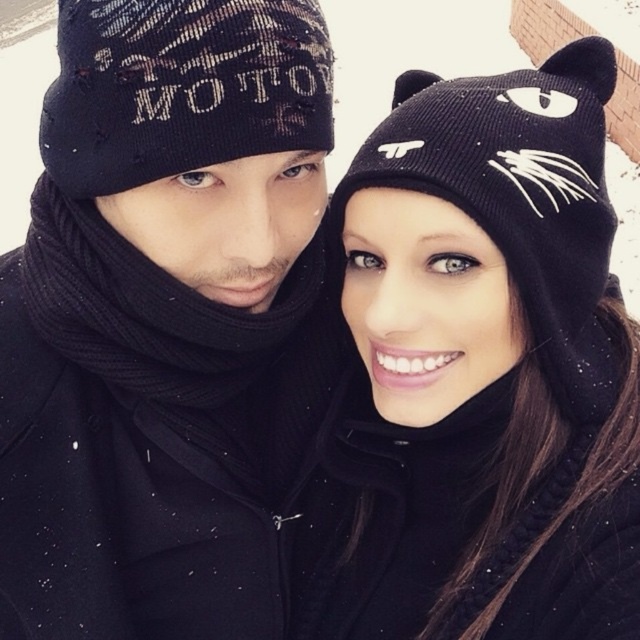
Does matte black beanie at center have a greater width compared to black knitted beanie at left?

Yes.

Does point (164, 138) come in front of point (312, 3)?

Yes, point (164, 138) is in front of point (312, 3).

In order to click on matte black beanie at center in this screenshot , I will do `click(164, 321)`.

Between black knit beanie with cat ears at upper right and black knitted beanie at left, which one is positioned higher?

black knitted beanie at left

Does black knit beanie with cat ears at upper right have a lesser height compared to black knitted beanie at left?

No, black knit beanie with cat ears at upper right is not shorter than black knitted beanie at left.

Is point (602, 444) closer to viewer compared to point (326, 58)?

That is True.

At what (x,y) coordinates should I click in order to perform the action: click on black knit beanie with cat ears at upper right. Please return your answer as a coordinate pair (x, y). Looking at the image, I should click on (477, 372).

Which of these two, matte black beanie at center or black knit beanie with cat ears at upper right, stands taller?

Standing taller between the two is matte black beanie at center.

Is matte black beanie at center behind black knit beanie with cat ears at upper right?

Yes, it is.

Is point (300, 88) closer to camera compared to point (550, 76)?

Yes, point (300, 88) is in front of point (550, 76).

Identify the location of matte black beanie at center. (164, 321).